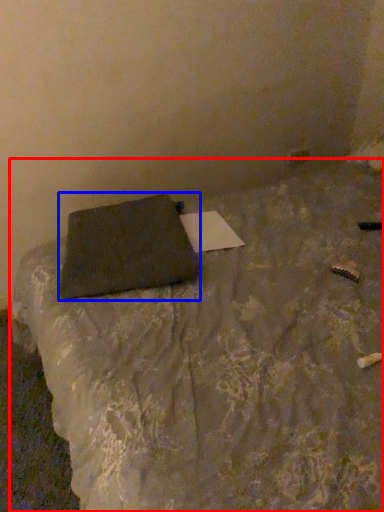
Question: Among these objects, which one is nearest to the camera, furniture (highlighted by a red box) or pillow (highlighted by a blue box)?

Choices:
 (A) furniture
 (B) pillow

Answer: (A)